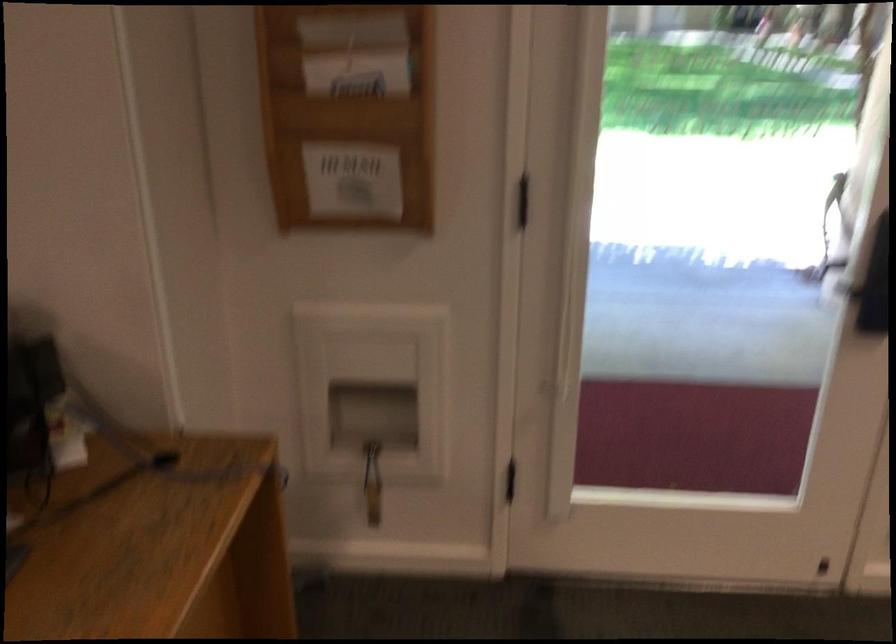
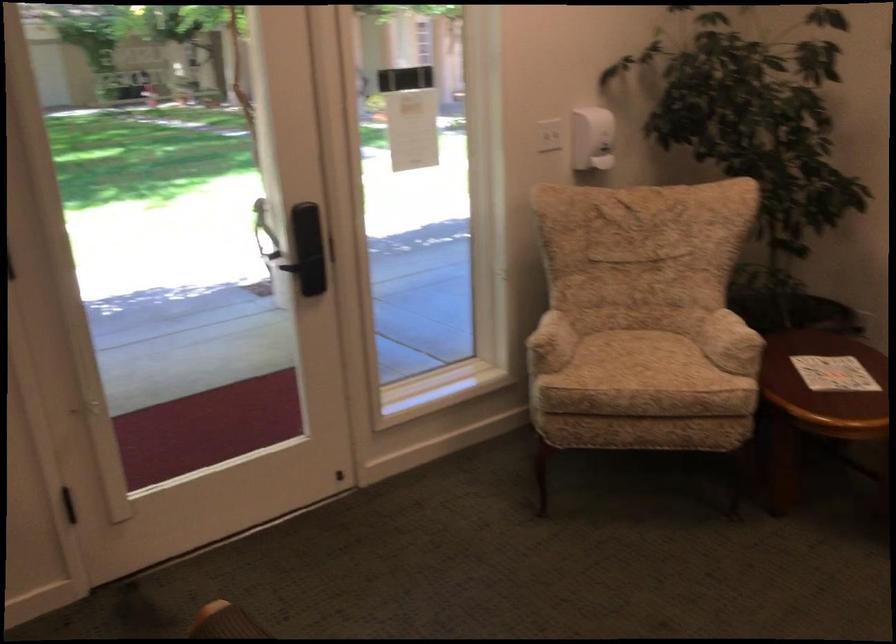
Question: The images are taken continuously from a first-person perspective. In which direction is your viewpoint rotating?

Choices:
 (A) Left
 (B) Right
 (C) Up
 (D) Down

Answer: (B)